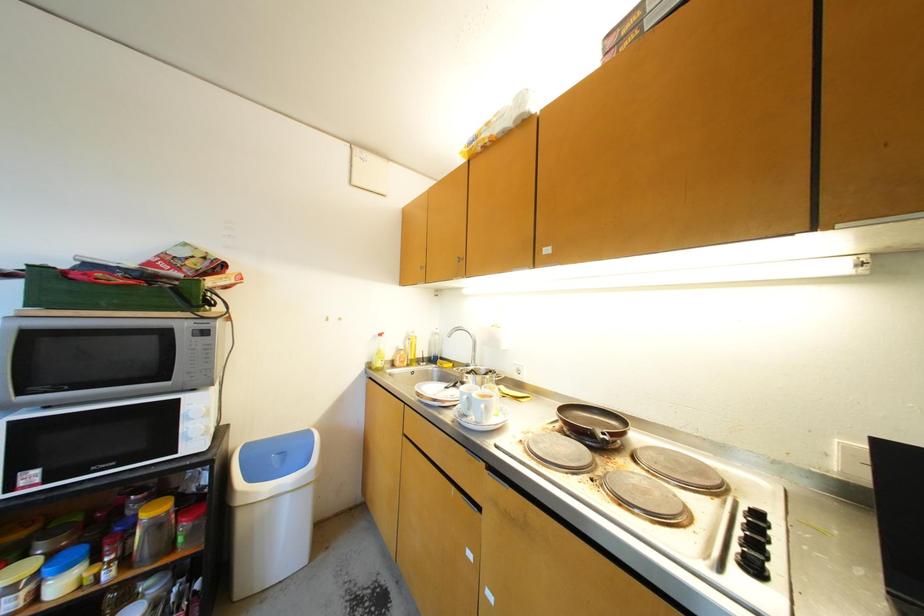
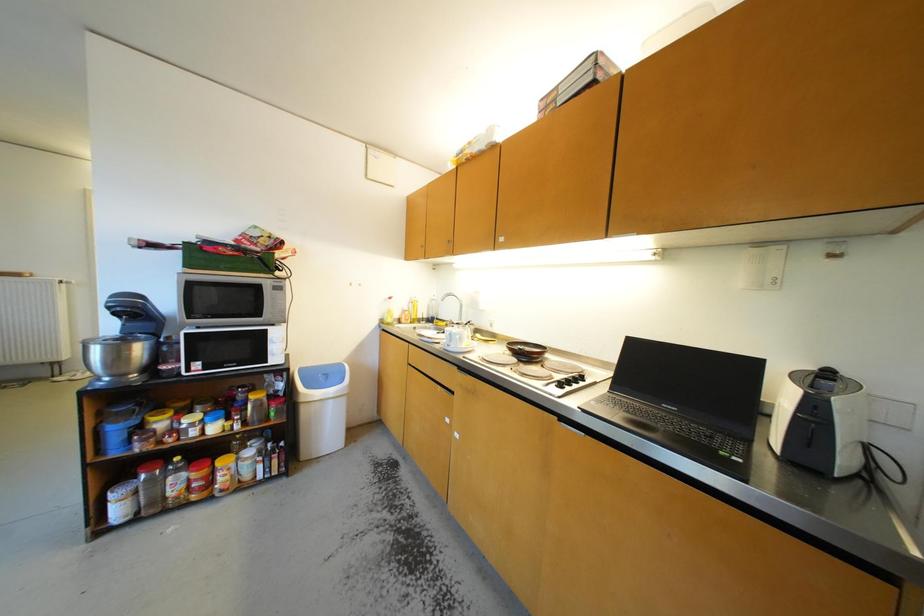
Question: What movement of the cameraman would produce the second image?

Choices:
 (A) Left
 (B) Right
 (C) Forward
 (D) Backward

Answer: (D)